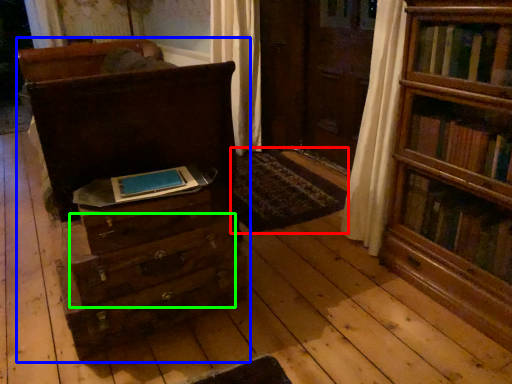
Question: Which object is positioned closest to mat (highlighted by a red box)? Select from chest of drawers (highlighted by a blue box) and drawer (highlighted by a green box).

Choices:
 (A) chest of drawers
 (B) drawer

Answer: (A)